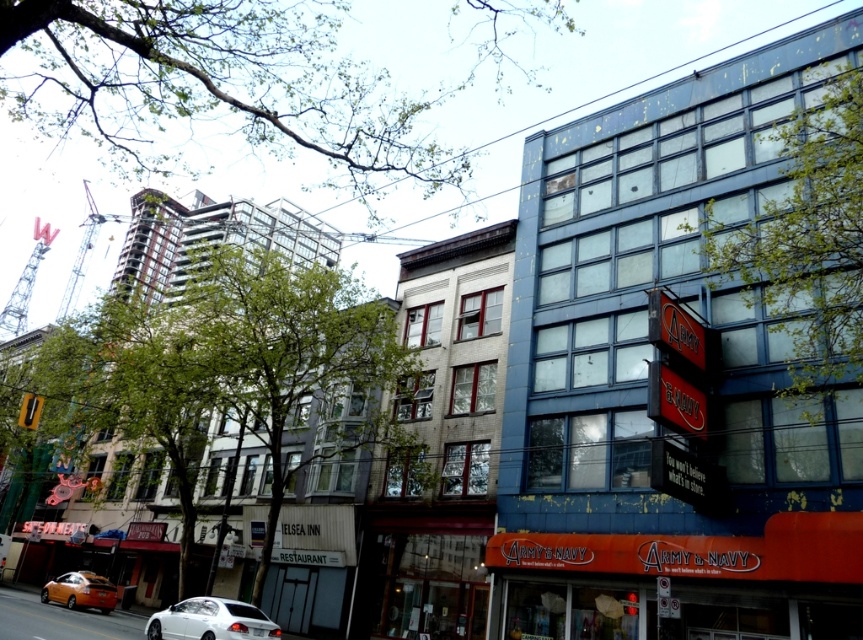
Question: Does white glossy sedan at lower center appear on the left side of orange matte car at lower left?

Choices:
 (A) yes
 (B) no

Answer: (B)

Question: Is white glossy sedan at lower center to the left of orange matte car at lower left from the viewer's perspective?

Choices:
 (A) no
 (B) yes

Answer: (A)

Question: Does white glossy sedan at lower center appear on the left side of orange matte car at lower left?

Choices:
 (A) no
 (B) yes

Answer: (A)

Question: Which point is farther to the camera?

Choices:
 (A) (168, 630)
 (B) (106, 580)

Answer: (B)